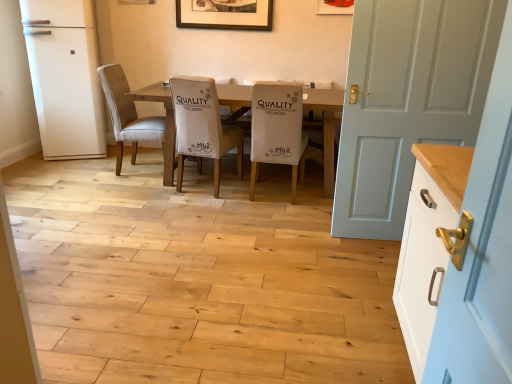
Identify the location of vacant space in front of wooden table at center. (234, 234).